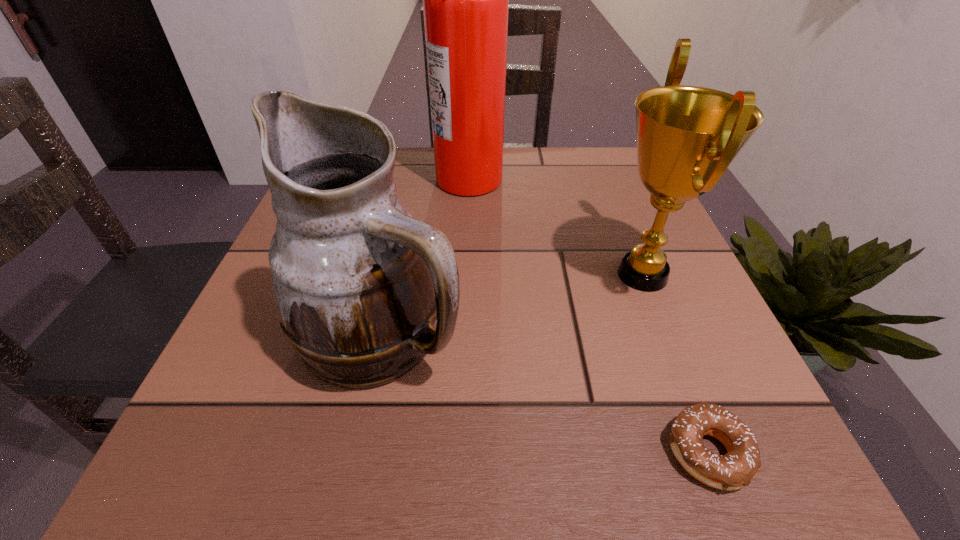
Find the location of a particular element. Image resolution: width=960 pixels, height=540 pixels. the tallest object is located at coordinates (465, 0).

The height and width of the screenshot is (540, 960). I want to click on the farthest object, so click(465, 0).

This screenshot has height=540, width=960. I want to click on award, so click(687, 136).

Where is `pitcher`? The width and height of the screenshot is (960, 540). pitcher is located at coordinates (358, 282).

In order to click on the nearest object in this screenshot , I will do `click(735, 469)`.

This screenshot has width=960, height=540. In order to click on doughnut in this screenshot , I will do `click(735, 469)`.

Where is `vacant area situated 0.300m at the nozzle of the fire extinguisher`? Image resolution: width=960 pixels, height=540 pixels. vacant area situated 0.300m at the nozzle of the fire extinguisher is located at coordinates (633, 178).

The width and height of the screenshot is (960, 540). In order to click on free spot located 0.240m on the front view with handles of the award in this screenshot , I will do `click(461, 275)`.

You are a GUI agent. You are given a task and a screenshot of the screen. Output one action in this format:
    pyautogui.click(x=<x>, y=<y>)
    Task: Click on the free spot located 0.250m on the front view with handles of the award
    The height and width of the screenshot is (540, 960).
    Given the screenshot: What is the action you would take?
    pyautogui.click(x=456, y=275)

Where is `vacant area situated on the front view with handles of the award`? vacant area situated on the front view with handles of the award is located at coordinates (376, 275).